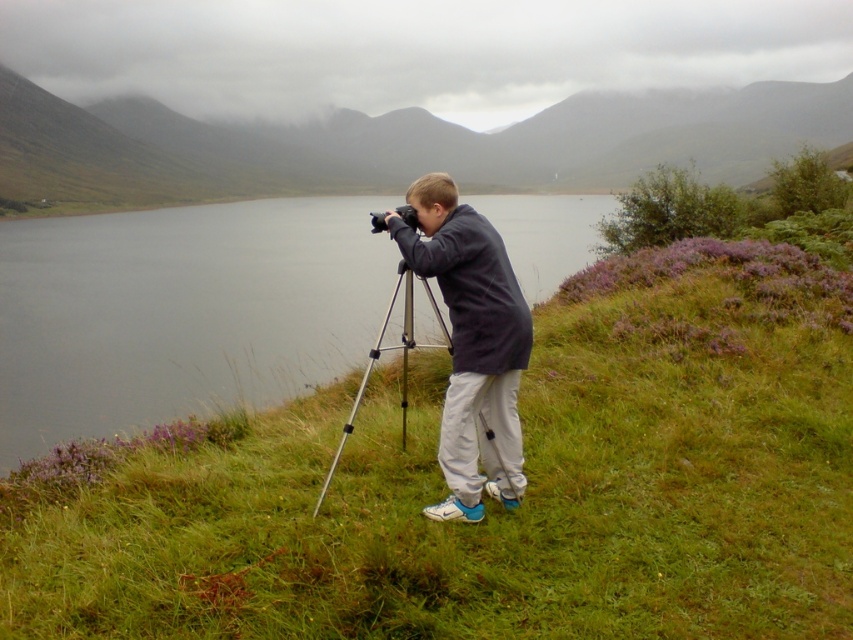
Does green grassy at center have a greater width compared to silver metallic tripod at center?

Correct, the width of green grassy at center exceeds that of silver metallic tripod at center.

Between point (115, 486) and point (334, 454), which one is positioned behind?

The point (334, 454) is more distant.

Measure the distance between point [100,602] and camera.

Point [100,602] is 3.66 meters away from camera.

Identify the location of green grassy at center. (486, 499).

Which is more to the left, green grassy at center or smooth gray water at center?

From the viewer's perspective, smooth gray water at center appears more on the left side.

Is point (744, 342) positioned before point (183, 385)?

Yes.

Identify the location of green grassy at center. This screenshot has width=853, height=640. (486, 499).

Between dark gray jacket at center and black plastic camera at center, which one has less height?

With less height is black plastic camera at center.

Is dark gray jacket at center bigger than black plastic camera at center?

Yes.

Identify the location of dark gray jacket at center. The image size is (853, 640). (471, 344).